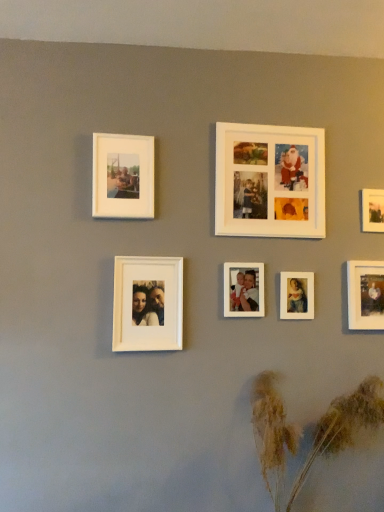
Question: From the image's perspective, is brown textured plant at lower right located beneath white matte photo frame at center, placed as the fifth picture frame when sorted from right to left?

Choices:
 (A) no
 (B) yes

Answer: (B)

Question: Does brown textured plant at lower right have a smaller size compared to white matte photo frame at center, arranged as the 3th picture frame when viewed from the left?

Choices:
 (A) no
 (B) yes

Answer: (A)

Question: Could you tell me if brown textured plant at lower right is turned towards white matte photo frame at center, placed as the fifth picture frame when sorted from right to left?

Choices:
 (A) yes
 (B) no

Answer: (B)

Question: Are brown textured plant at lower right and white matte photo frame at center, arranged as the 3th picture frame when viewed from the left, located far from each other?

Choices:
 (A) yes
 (B) no

Answer: (B)

Question: Is brown textured plant at lower right facing away from white matte photo frame at center, placed as the fifth picture frame when sorted from right to left?

Choices:
 (A) yes
 (B) no

Answer: (B)

Question: From a real-world perspective, is brown textured plant at lower right located higher than white matte photo frame at center, arranged as the 3th picture frame when viewed from the left?

Choices:
 (A) no
 (B) yes

Answer: (A)

Question: From a real-world perspective, is white matte photo frame at center, arranged as the 3th picture frame when viewed from the left, on matte white photo frame at lower right, the 6th picture frame from the left?

Choices:
 (A) yes
 (B) no

Answer: (A)

Question: Is white matte photo frame at center, placed as the fifth picture frame when sorted from right to left, oriented towards matte white photo frame at lower right, the 6th picture frame from the left?

Choices:
 (A) yes
 (B) no

Answer: (B)

Question: Is white matte photo frame at center, placed as the fifth picture frame when sorted from right to left, further to the viewer compared to matte white photo frame at lower right, positioned as the second picture frame in right-to-left order?

Choices:
 (A) yes
 (B) no

Answer: (B)

Question: Can you confirm if white matte photo frame at center, arranged as the 3th picture frame when viewed from the left, is taller than matte white photo frame at lower right, the 6th picture frame from the left?

Choices:
 (A) yes
 (B) no

Answer: (B)

Question: Is white matte photo frame at center, placed as the fifth picture frame when sorted from right to left, at the right side of matte white photo frame at lower right, the 6th picture frame from the left?

Choices:
 (A) yes
 (B) no

Answer: (B)

Question: Is white matte photo frame at center, arranged as the 3th picture frame when viewed from the left, smaller than matte white photo frame at lower right, the 6th picture frame from the left?

Choices:
 (A) yes
 (B) no

Answer: (A)

Question: Is white matte photo frame at center, placed as the fifth picture frame when sorted from right to left, in front of white matte photo frame at upper center, arranged as the fourth picture frame when viewed from the left?

Choices:
 (A) no
 (B) yes

Answer: (A)